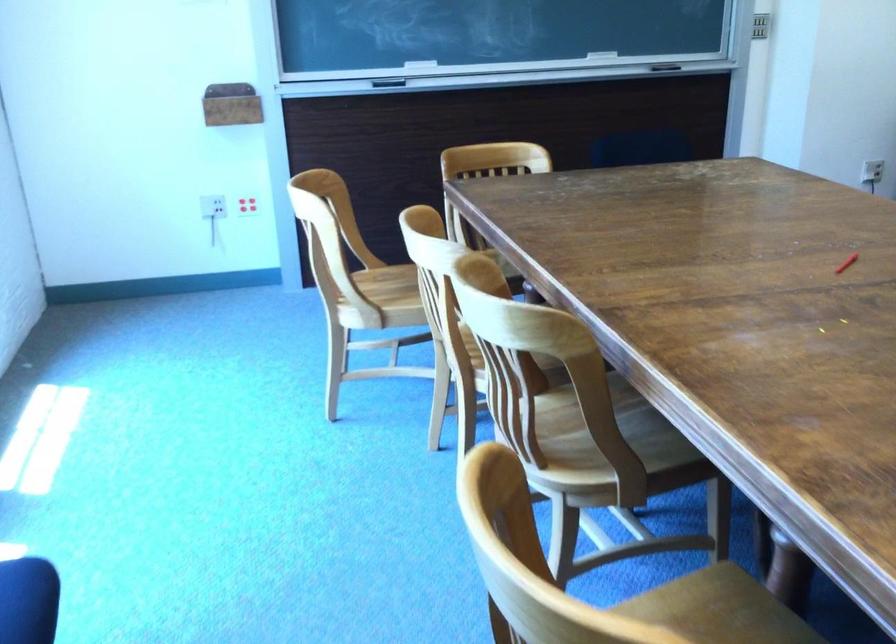
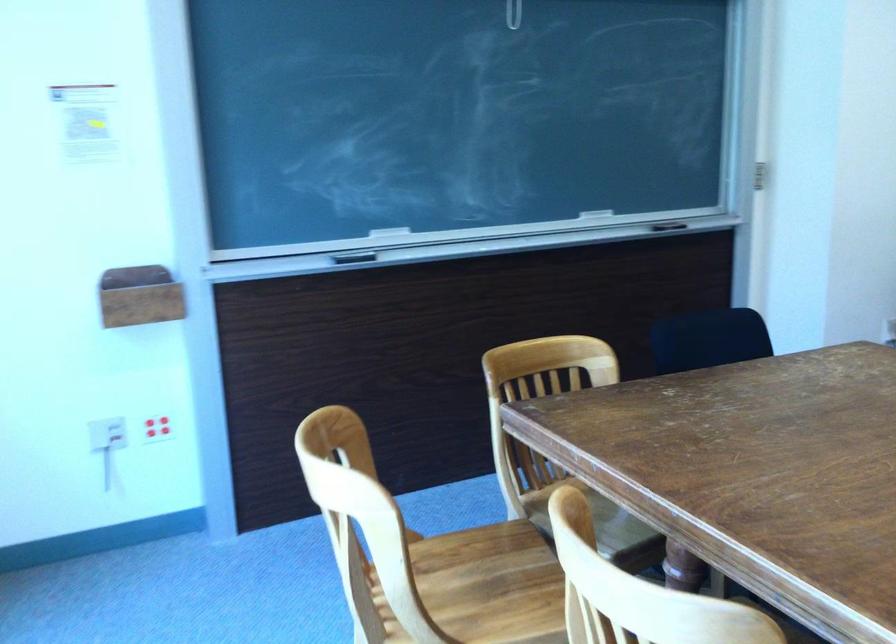
What movement of the cameraman would produce the second image?

The cameraman moved toward left, forward.